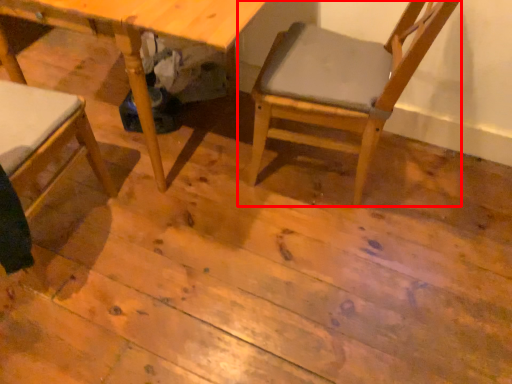
Question: From the image's perspective, what is the correct spatial positioning of chair (annotated by the red box) in reference to table?

Choices:
 (A) below
 (B) above

Answer: (A)